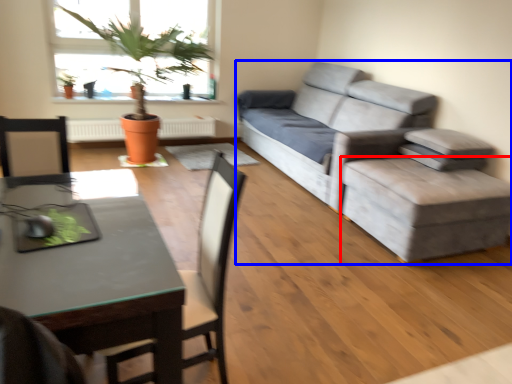
Question: Which object is closer to the camera taking this photo, stool (highlighted by a red box) or studio couch (highlighted by a blue box)?

Choices:
 (A) stool
 (B) studio couch

Answer: (A)